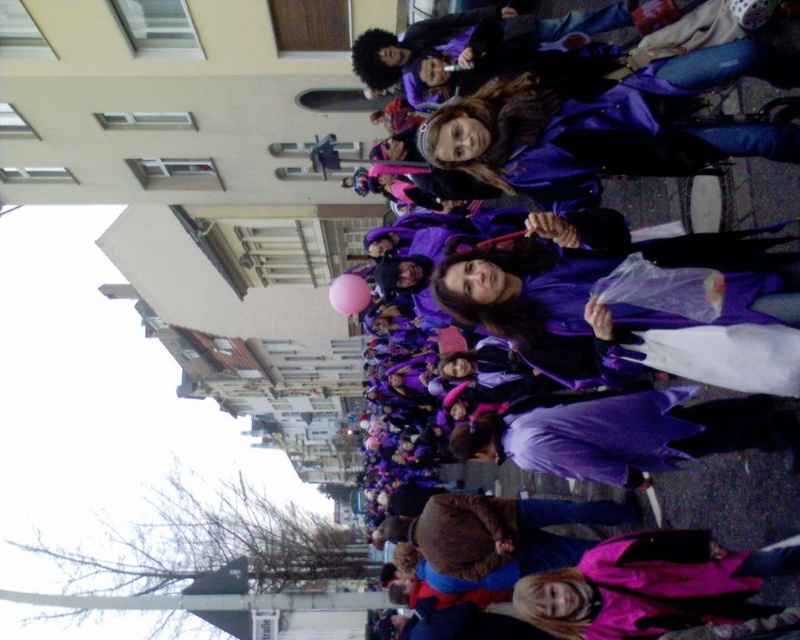
Question: Can you confirm if brown fuzzy hat at center is positioned above purple matte coat at center?

Choices:
 (A) no
 (B) yes

Answer: (A)

Question: Does brown fuzzy hat at center come in front of purple matte coat at center?

Choices:
 (A) no
 (B) yes

Answer: (A)

Question: Which of the following is the closest to the observer?

Choices:
 (A) (412, 536)
 (B) (698, 216)

Answer: (B)

Question: Is brown fuzzy hat at center wider than purple matte coat at center?

Choices:
 (A) yes
 (B) no

Answer: (B)